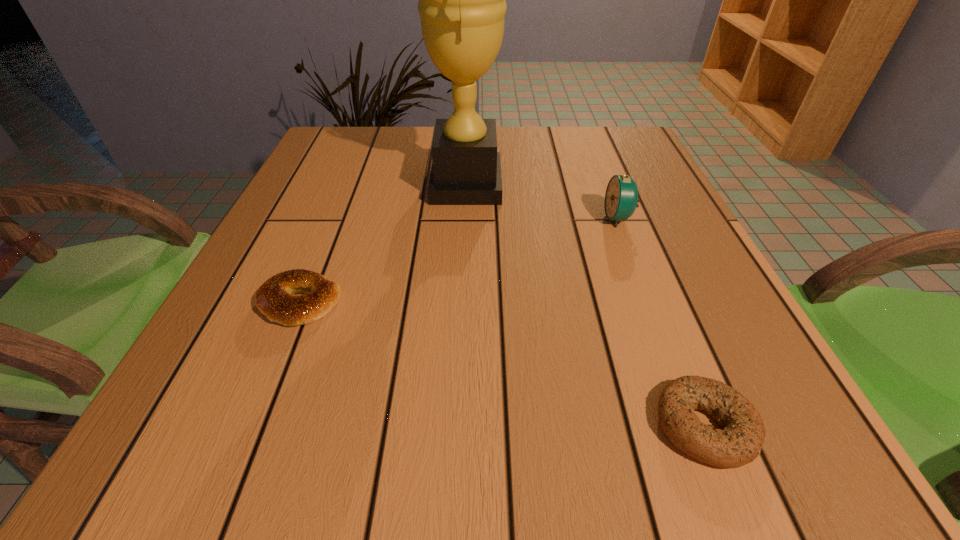
Find the location of a particular element. This screenshot has width=960, height=540. the tallest object is located at coordinates (462, 6).

Identify the location of the second object from left to right. The height and width of the screenshot is (540, 960). (462, 6).

Locate an element on the screen. Image resolution: width=960 pixels, height=540 pixels. the third shortest object is located at coordinates (621, 198).

Where is `the right bagel`? The width and height of the screenshot is (960, 540). the right bagel is located at coordinates (740, 441).

Locate an element on the screen. The image size is (960, 540). the nearest object is located at coordinates (740, 441).

Where is `the left bagel`? the left bagel is located at coordinates (274, 298).

Find the location of a particular element. The width and height of the screenshot is (960, 540). the third farthest object is located at coordinates (274, 298).

Locate an element on the screen. This screenshot has height=540, width=960. free space located at the front of the tallest object with handles is located at coordinates (648, 184).

Find the location of a particular element. This screenshot has height=540, width=960. free location located 0.110m on the front-facing side of the third shortest object is located at coordinates (552, 218).

At what (x,y) coordinates should I click in order to perform the action: click on free space located on the front-facing side of the third shortest object. Please return your answer as a coordinate pair (x, y). Looking at the image, I should click on (566, 218).